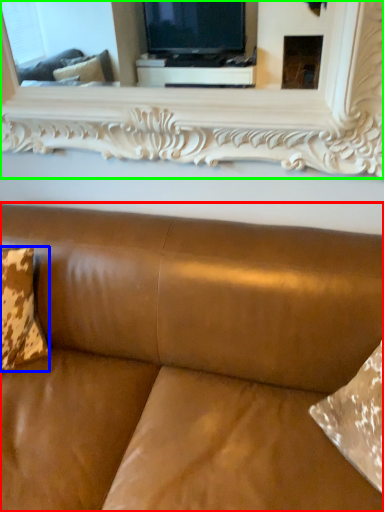
Question: Which is farther away from studio couch (highlighted by a red box)? pillow (highlighted by a blue box) or mirror (highlighted by a green box)?

Choices:
 (A) pillow
 (B) mirror

Answer: (B)